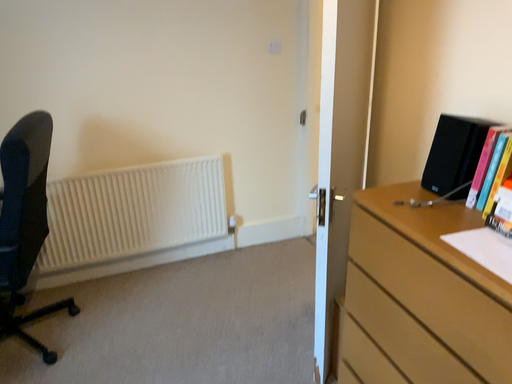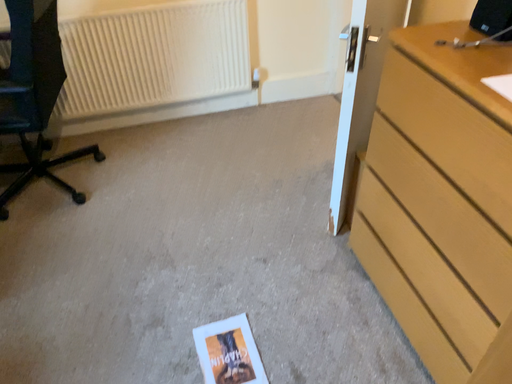
Question: Which way did the camera rotate in the video?

Choices:
 (A) rotated downward
 (B) rotated upward

Answer: (A)